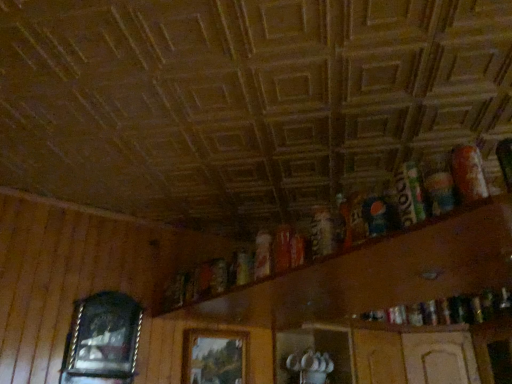
What do you see at coordinates (214, 357) in the screenshot? Image resolution: width=512 pixels, height=384 pixels. I see `wooden picture frame at center, the second picture frame when ordered from left to right` at bounding box center [214, 357].

How much space does wooden cabinet at lower center, marked as the 2th shelf in a right-to-left arrangement, occupy vertically?

The height of wooden cabinet at lower center, marked as the 2th shelf in a right-to-left arrangement, is 11.32 inches.

The width and height of the screenshot is (512, 384). I want to click on wooden shelf at upper right, the 1th shelf from the right, so click(x=395, y=266).

The width and height of the screenshot is (512, 384). Identify the location of wooden picture frame at center, acting as the first picture frame starting from the right. (214, 357).

Which of these two, wooden shelf at upper right, the 2th shelf in the left-to-right sequence, or wooden picture frame at center, the second picture frame when ordered from left to right, is thinner?

Thinner between the two is wooden picture frame at center, the second picture frame when ordered from left to right.

Can you tell me how much wooden shelf at upper right, the 1th shelf from the right, and wooden picture frame at center, the second picture frame when ordered from left to right, differ in facing direction?

wooden shelf at upper right, the 1th shelf from the right, and wooden picture frame at center, the second picture frame when ordered from left to right, are facing 89.7 degrees away from each other.

Considering the relative sizes of wooden shelf at upper right, the 1th shelf from the right, and wooden picture frame at center, acting as the first picture frame starting from the right, in the image provided, is wooden shelf at upper right, the 1th shelf from the right, taller than wooden picture frame at center, acting as the first picture frame starting from the right,?

In fact, wooden shelf at upper right, the 1th shelf from the right, may be shorter than wooden picture frame at center, acting as the first picture frame starting from the right.

Considering the relative sizes of wooden cabinet at lower center, which ranks as the first shelf in left-to-right order, and wooden picture frame at left, which is the 2th picture frame from right to left, in the image provided, is wooden cabinet at lower center, which ranks as the first shelf in left-to-right order, taller than wooden picture frame at left, which is the 2th picture frame from right to left,?

No, wooden cabinet at lower center, which ranks as the first shelf in left-to-right order, is not taller than wooden picture frame at left, which is the 2th picture frame from right to left.

Can you tell me how much wooden cabinet at lower center, marked as the 2th shelf in a right-to-left arrangement, and wooden picture frame at left, the 1th picture frame from the left, differ in facing direction?

They differ by 0.747 degrees in their facing directions.

Does wooden cabinet at lower center, which ranks as the first shelf in left-to-right order, have a lesser width compared to wooden picture frame at left, which is the 2th picture frame from right to left?

No.

From a real-world perspective, is wooden cabinet at lower center, which ranks as the first shelf in left-to-right order, positioned above or below wooden picture frame at left, the 1th picture frame from the left?

In terms of real-world spatial position, wooden cabinet at lower center, which ranks as the first shelf in left-to-right order, is below wooden picture frame at left, the 1th picture frame from the left.

Between wooden picture frame at center, acting as the first picture frame starting from the right, and wooden picture frame at left, which is the 2th picture frame from right to left, which one has larger size?

With larger size is wooden picture frame at left, which is the 2th picture frame from right to left.

Is wooden picture frame at center, acting as the first picture frame starting from the right, facing towards wooden picture frame at left, the 1th picture frame from the left?

No, wooden picture frame at center, acting as the first picture frame starting from the right, is not facing towards wooden picture frame at left, the 1th picture frame from the left.

Considering the relative sizes of wooden picture frame at center, acting as the first picture frame starting from the right, and wooden picture frame at left, which is the 2th picture frame from right to left, in the image provided, is wooden picture frame at center, acting as the first picture frame starting from the right, wider than wooden picture frame at left, which is the 2th picture frame from right to left,?

Incorrect, the width of wooden picture frame at center, acting as the first picture frame starting from the right, does not surpass that of wooden picture frame at left, which is the 2th picture frame from right to left.

From the image's perspective, relative to wooden cabinet at lower center, which ranks as the first shelf in left-to-right order, is wooden picture frame at center, the second picture frame when ordered from left to right, above or below?

wooden picture frame at center, the second picture frame when ordered from left to right, is situated higher than wooden cabinet at lower center, which ranks as the first shelf in left-to-right order, in the image.

Would you say wooden picture frame at center, the second picture frame when ordered from left to right, is to the left or to the right of wooden cabinet at lower center, which ranks as the first shelf in left-to-right order, in the picture?

wooden picture frame at center, the second picture frame when ordered from left to right, is positioned on wooden cabinet at lower center, which ranks as the first shelf in left-to-right order,'s left side.

Between point (201, 350) and point (410, 376), which one is positioned behind?

The point (410, 376) is behind.

Does wooden picture frame at center, acting as the first picture frame starting from the right, have a lesser width compared to wooden cabinet at lower center, marked as the 2th shelf in a right-to-left arrangement?

Indeed, wooden picture frame at center, acting as the first picture frame starting from the right, has a lesser width compared to wooden cabinet at lower center, marked as the 2th shelf in a right-to-left arrangement.

The width and height of the screenshot is (512, 384). In order to click on the 1st picture frame behind the wooden shelf at upper right, the 1th shelf from the right in this screenshot , I will do `click(102, 340)`.

Considering the positions of objects wooden picture frame at left, the 1th picture frame from the left, and wooden shelf at upper right, the 1th shelf from the right, in the image provided, who is behind, wooden picture frame at left, the 1th picture frame from the left, or wooden shelf at upper right, the 1th shelf from the right,?

wooden picture frame at left, the 1th picture frame from the left, is more distant.

Considering the sizes of wooden picture frame at left, the 1th picture frame from the left, and wooden shelf at upper right, the 2th shelf in the left-to-right sequence, in the image, is wooden picture frame at left, the 1th picture frame from the left, wider or thinner than wooden shelf at upper right, the 2th shelf in the left-to-right sequence,?

Considering their sizes, wooden picture frame at left, the 1th picture frame from the left, looks slimmer than wooden shelf at upper right, the 2th shelf in the left-to-right sequence.

Are wooden picture frame at left, the 1th picture frame from the left, and wooden shelf at upper right, the 2th shelf in the left-to-right sequence, making contact?

wooden picture frame at left, the 1th picture frame from the left, is not next to wooden shelf at upper right, the 2th shelf in the left-to-right sequence, and they're not touching.

Can you confirm if wooden picture frame at left, the 1th picture frame from the left, is positioned to the left of wooden picture frame at center, the second picture frame when ordered from left to right?

Indeed, wooden picture frame at left, the 1th picture frame from the left, is positioned on the left side of wooden picture frame at center, the second picture frame when ordered from left to right.

Is wooden picture frame at left, the 1th picture frame from the left, positioned in front of wooden picture frame at center, the second picture frame when ordered from left to right?

That is True.

Locate an element on the screen. The height and width of the screenshot is (384, 512). picture frame on the right side of wooden picture frame at left, the 1th picture frame from the left is located at coordinates (214, 357).

Does point (95, 317) lie behind point (191, 335)?

No, (95, 317) is closer to viewer.

Which of these two, wooden picture frame at center, acting as the first picture frame starting from the right, or wooden shelf at upper right, the 1th shelf from the right, is bigger?

wooden shelf at upper right, the 1th shelf from the right, is bigger.

Considering the relative sizes of wooden picture frame at center, the second picture frame when ordered from left to right, and wooden shelf at upper right, the 1th shelf from the right, in the image provided, is wooden picture frame at center, the second picture frame when ordered from left to right, shorter than wooden shelf at upper right, the 1th shelf from the right,?

Incorrect, the height of wooden picture frame at center, the second picture frame when ordered from left to right, does not fall short of that of wooden shelf at upper right, the 1th shelf from the right.

Can you confirm if wooden picture frame at center, the second picture frame when ordered from left to right, is positioned to the left of wooden shelf at upper right, the 1th shelf from the right?

Indeed, wooden picture frame at center, the second picture frame when ordered from left to right, is positioned on the left side of wooden shelf at upper right, the 1th shelf from the right.

Which object is further away from the camera, wooden picture frame at center, the second picture frame when ordered from left to right, or wooden shelf at upper right, the 1th shelf from the right?

Positioned behind is wooden picture frame at center, the second picture frame when ordered from left to right.

The height and width of the screenshot is (384, 512). What are the coordinates of `the 2nd picture frame behind the wooden shelf at upper right, the 1th shelf from the right, starting your count from the anchor` in the screenshot? It's located at (214, 357).

Where is `the 1st shelf to the right of the wooden picture frame at left, which is the 2th picture frame from right to left, counting from the anchor's position`? Image resolution: width=512 pixels, height=384 pixels. the 1st shelf to the right of the wooden picture frame at left, which is the 2th picture frame from right to left, counting from the anchor's position is located at coordinates (398, 352).

Which object lies nearer to the anchor point wooden shelf at upper right, the 1th shelf from the right, wooden cabinet at lower center, marked as the 2th shelf in a right-to-left arrangement, or wooden picture frame at center, acting as the first picture frame starting from the right?

wooden picture frame at center, acting as the first picture frame starting from the right, lies closer to wooden shelf at upper right, the 1th shelf from the right, than the other object.

Considering their positions, is wooden picture frame at left, which is the 2th picture frame from right to left, positioned closer to wooden picture frame at center, acting as the first picture frame starting from the right, than wooden shelf at upper right, the 1th shelf from the right?

wooden picture frame at left, which is the 2th picture frame from right to left, is positioned closer to the anchor wooden picture frame at center, acting as the first picture frame starting from the right.

Based on their spatial positions, is wooden cabinet at lower center, marked as the 2th shelf in a right-to-left arrangement, or wooden picture frame at left, which is the 2th picture frame from right to left, closer to wooden shelf at upper right, the 2th shelf in the left-to-right sequence?

Based on the image, wooden picture frame at left, which is the 2th picture frame from right to left, appears to be nearer to wooden shelf at upper right, the 2th shelf in the left-to-right sequence.

Looking at the image, which one is located closer to wooden picture frame at center, the second picture frame when ordered from left to right, wooden cabinet at lower center, which ranks as the first shelf in left-to-right order, or wooden shelf at upper right, the 1th shelf from the right?

wooden cabinet at lower center, which ranks as the first shelf in left-to-right order, lies closer to wooden picture frame at center, the second picture frame when ordered from left to right, than the other object.

Looking at the image, which one is located closer to wooden picture frame at center, acting as the first picture frame starting from the right, wooden cabinet at lower center, which ranks as the first shelf in left-to-right order, or wooden picture frame at left, the 1th picture frame from the left?

Among the two, wooden picture frame at left, the 1th picture frame from the left, is located nearer to wooden picture frame at center, acting as the first picture frame starting from the right.

Looking at this image, which object lies further to the anchor point wooden shelf at upper right, the 2th shelf in the left-to-right sequence, wooden picture frame at left, which is the 2th picture frame from right to left, or wooden cabinet at lower center, which ranks as the first shelf in left-to-right order?

Based on the image, wooden cabinet at lower center, which ranks as the first shelf in left-to-right order, appears to be further to wooden shelf at upper right, the 2th shelf in the left-to-right sequence.

Estimate the real-world distances between objects in this image. Which object is further from wooden cabinet at lower center, marked as the 2th shelf in a right-to-left arrangement, wooden shelf at upper right, the 1th shelf from the right, or wooden picture frame at left, which is the 2th picture frame from right to left?

wooden picture frame at left, which is the 2th picture frame from right to left, is positioned further to the anchor wooden cabinet at lower center, marked as the 2th shelf in a right-to-left arrangement.

Considering their positions, is wooden shelf at upper right, the 2th shelf in the left-to-right sequence, positioned further to wooden cabinet at lower center, marked as the 2th shelf in a right-to-left arrangement, than wooden picture frame at center, the second picture frame when ordered from left to right?

wooden shelf at upper right, the 2th shelf in the left-to-right sequence, lies further to wooden cabinet at lower center, marked as the 2th shelf in a right-to-left arrangement, than the other object.

The width and height of the screenshot is (512, 384). What are the coordinates of `shelf between wooden picture frame at left, the 1th picture frame from the left, and wooden shelf at upper right, the 2th shelf in the left-to-right sequence, from left to right` in the screenshot? It's located at (398, 352).

At what (x,y) coordinates should I click in order to perform the action: click on picture frame located between wooden picture frame at left, the 1th picture frame from the left, and wooden shelf at upper right, the 2th shelf in the left-to-right sequence, in the left-right direction. Please return your answer as a coordinate pair (x, y). Looking at the image, I should click on (214, 357).

Identify the location of picture frame between wooden picture frame at left, which is the 2th picture frame from right to left, and wooden cabinet at lower center, marked as the 2th shelf in a right-to-left arrangement, in the horizontal direction. (214, 357).